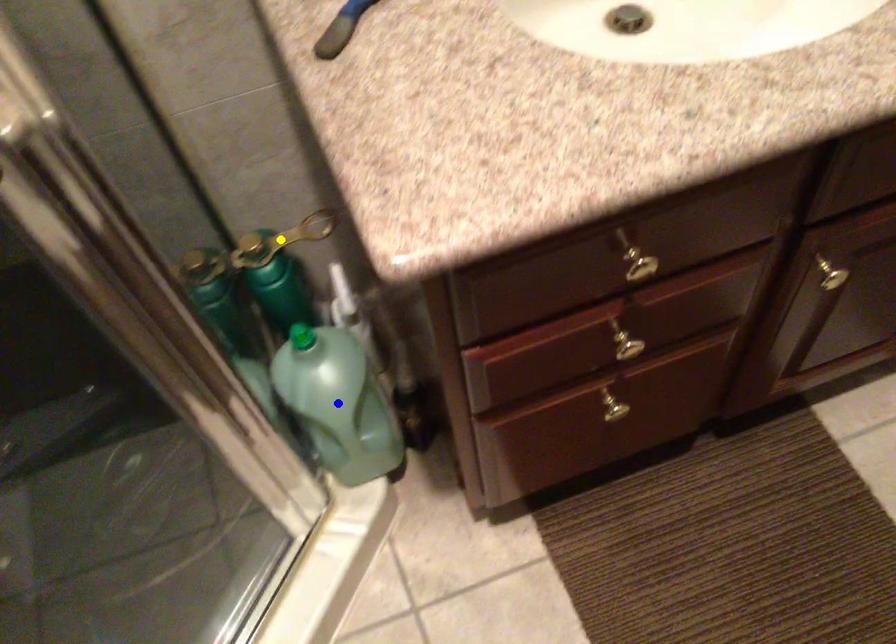
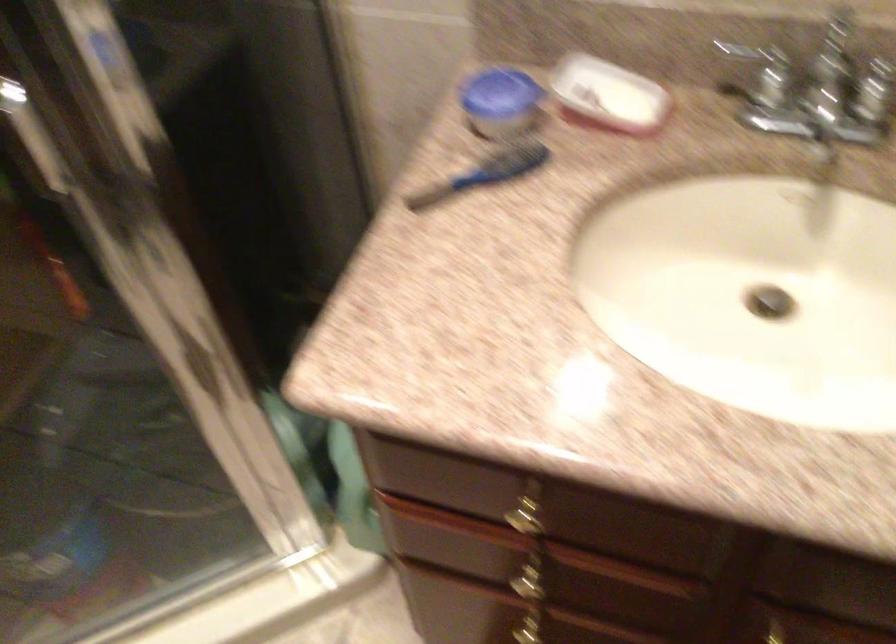
I am providing you with two images of the same scene from different viewpoints. Three points are marked in image1. Which point corresponds to a part or object that is occluded in image2?In image1, three points are marked. Which of them correspond to a part or object that is occluded in image2?Among the three points shown in image1, which one corresponds to a part or object that is no longer visible due to occlusion in image2?

blue point, green point, yellow point